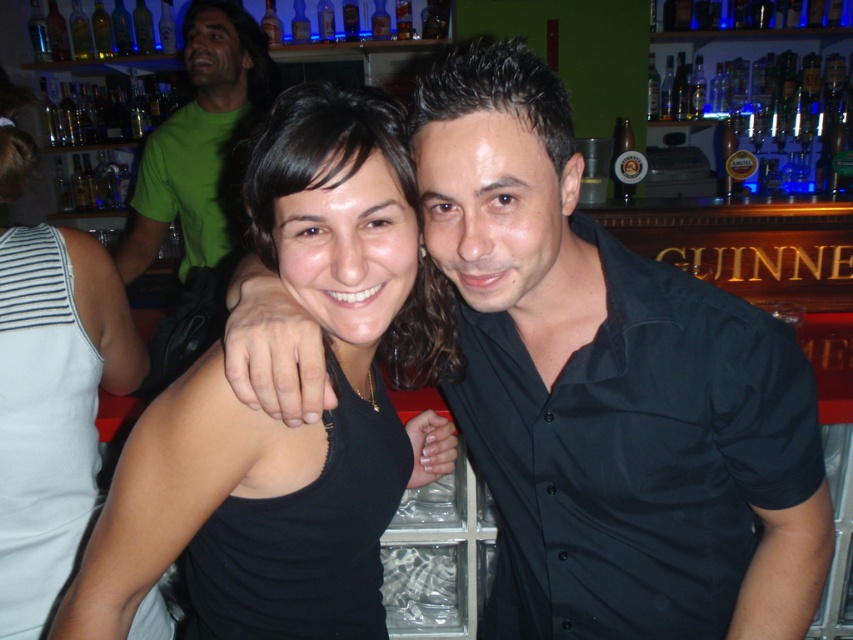
You are a photographer trying to capture the black matte tank top at center and the clear glass bottle at upper center in a single shot. Which object should you focus on first if you want to ensure both are in sharp focus, considering their sizes?

The black matte tank top at center has a larger size compared to the clear glass bottle at upper center, so you should focus on the black matte tank top at center first to ensure both are in sharp focus.

You are a photographer taking a picture of the clear glass bottle at upper center and the black matte tank top at center. Which object should you adjust your camera focus on first if you want to capture both in sharp detail?

The clear glass bottle at upper center should be focused on first because it is closer to the camera than the black matte tank top at center, which is positioned to the right of it.